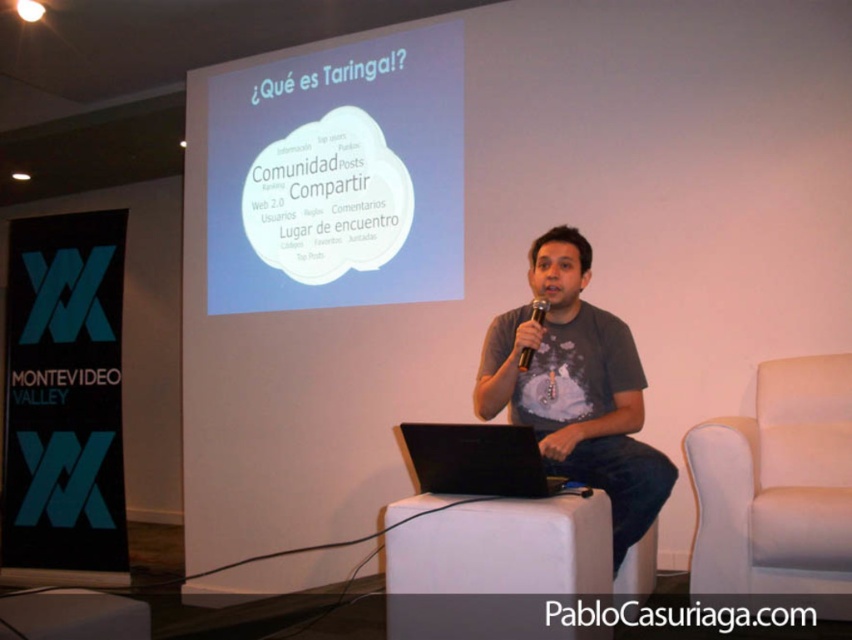
From the picture: You are setting up for a presentation and need to place a pointer on the white cloud at center. According to the coordinates provided, where exactly should you aim the pointer?

The white cloud at center is located at point (338,176), so aim the pointer at those coordinates to target it accurately.

In the scene shown: You are an audience member sitting in the front row. You notice the black paper at left and the black plastic microphone at center. Which object is closer to your left side?

The black paper at left is closer to your left side because it is positioned to the left of the black plastic microphone at center.